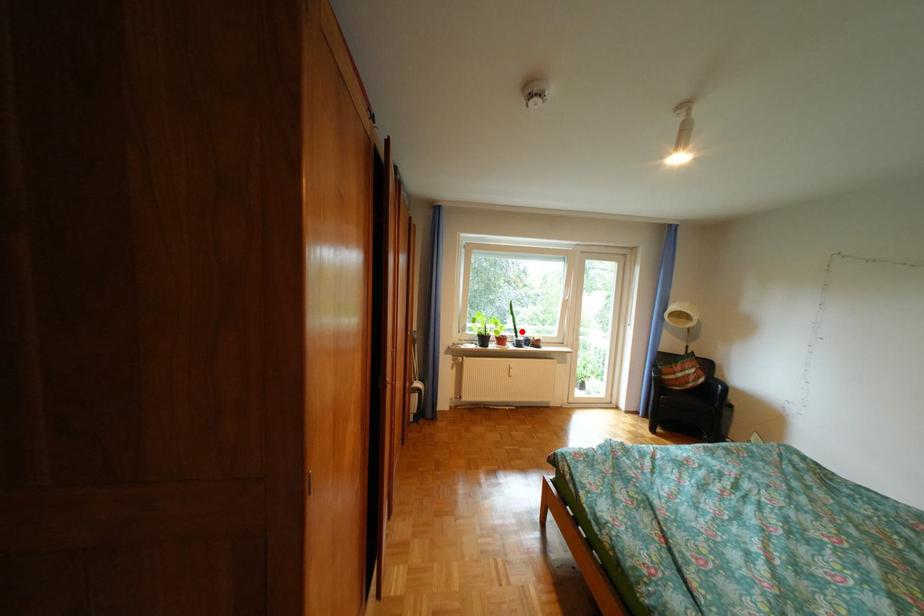
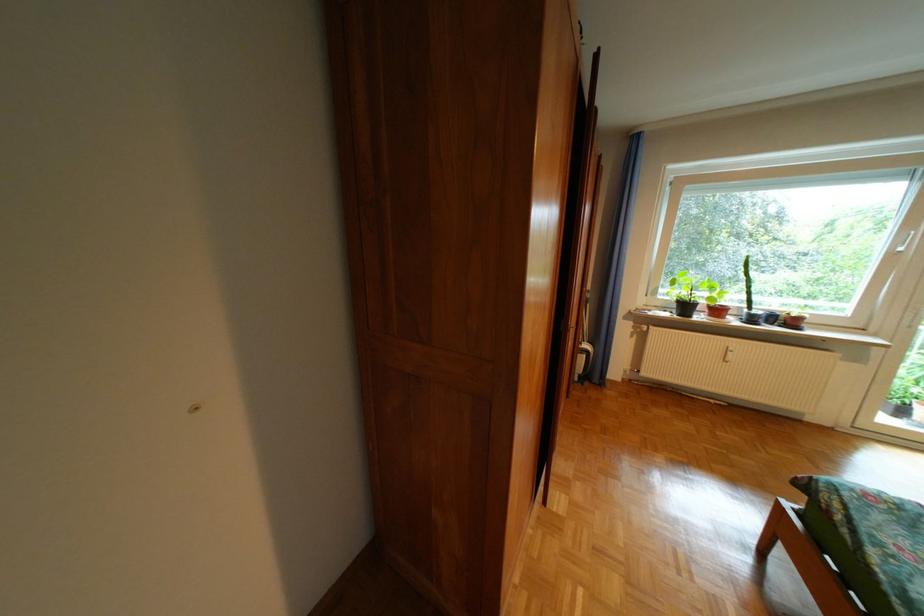
Find the pixel in the second image that matches the highlighted location in the first image.

(747, 300)